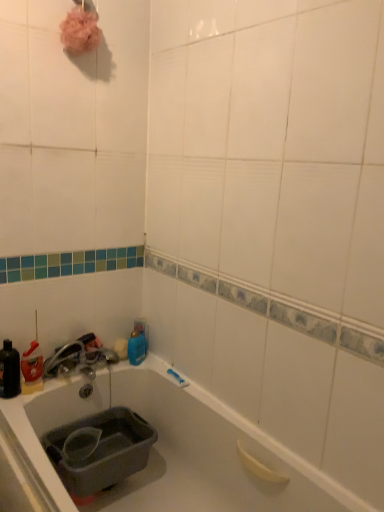
Question: Is the position of satin nickel faucet at lower left more distant than that of gray plastic sink at lower left?

Choices:
 (A) no
 (B) yes

Answer: (B)

Question: Is the position of satin nickel faucet at lower left less distant than that of gray plastic sink at lower left?

Choices:
 (A) yes
 (B) no

Answer: (B)

Question: From a real-world perspective, is satin nickel faucet at lower left on top of gray plastic sink at lower left?

Choices:
 (A) no
 (B) yes

Answer: (B)

Question: From a real-world perspective, does satin nickel faucet at lower left sit lower than gray plastic sink at lower left?

Choices:
 (A) no
 (B) yes

Answer: (A)

Question: Considering the relative sizes of satin nickel faucet at lower left and gray plastic sink at lower left in the image provided, is satin nickel faucet at lower left smaller than gray plastic sink at lower left?

Choices:
 (A) yes
 (B) no

Answer: (A)

Question: Considering the relative sizes of satin nickel faucet at lower left and gray plastic sink at lower left in the image provided, is satin nickel faucet at lower left taller than gray plastic sink at lower left?

Choices:
 (A) no
 (B) yes

Answer: (A)

Question: Is gray plastic sink at lower left to the right of blue glossy bottle at upper center, which appears as the first bottle when viewed from the right, from the viewer's perspective?

Choices:
 (A) yes
 (B) no

Answer: (B)

Question: Is blue glossy bottle at upper center, which appears as the first bottle when viewed from the right, surrounded by gray plastic sink at lower left?

Choices:
 (A) no
 (B) yes

Answer: (A)

Question: Is gray plastic sink at lower left looking in the opposite direction of blue glossy bottle at upper center, the second bottle from the left?

Choices:
 (A) yes
 (B) no

Answer: (B)

Question: Does gray plastic sink at lower left turn towards blue glossy bottle at upper center, which appears as the first bottle when viewed from the right?

Choices:
 (A) no
 (B) yes

Answer: (A)

Question: Is gray plastic sink at lower left outside of blue glossy bottle at upper center, which appears as the first bottle when viewed from the right?

Choices:
 (A) yes
 (B) no

Answer: (A)

Question: Considering the relative sizes of gray plastic sink at lower left and blue glossy bottle at upper center, the second bottle from the left, in the image provided, is gray plastic sink at lower left thinner than blue glossy bottle at upper center, the second bottle from the left,?

Choices:
 (A) no
 (B) yes

Answer: (A)

Question: From a real-world perspective, is gray plastic sink at lower left physically above satin nickel faucet at lower left?

Choices:
 (A) yes
 (B) no

Answer: (B)